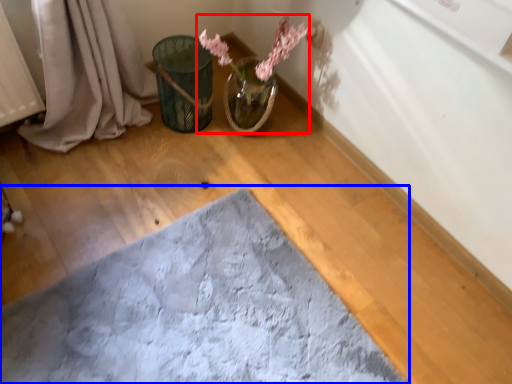
Question: Which point is further to the camera, floral arrangement (highlighted by a red box) or bath mat (highlighted by a blue box)?

Choices:
 (A) floral arrangement
 (B) bath mat

Answer: (A)